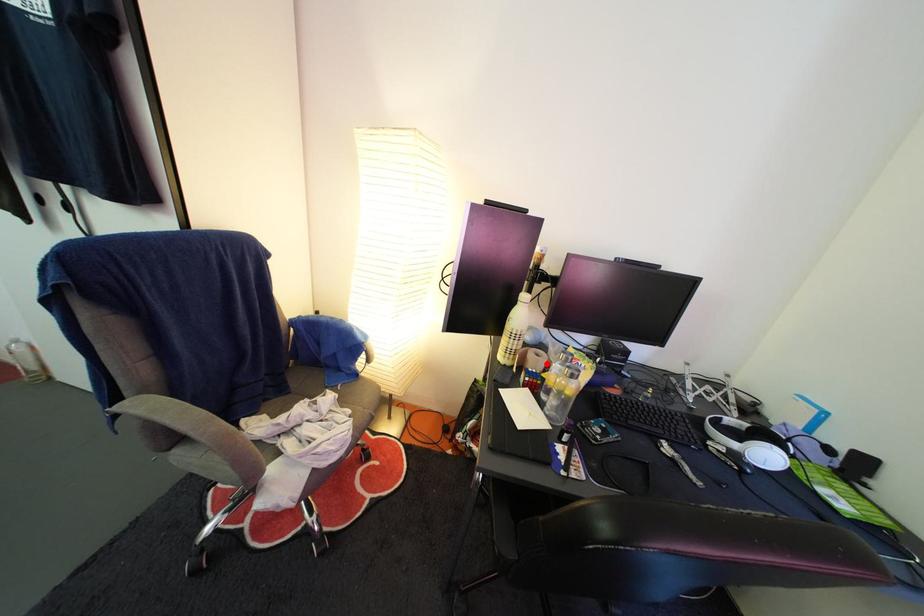
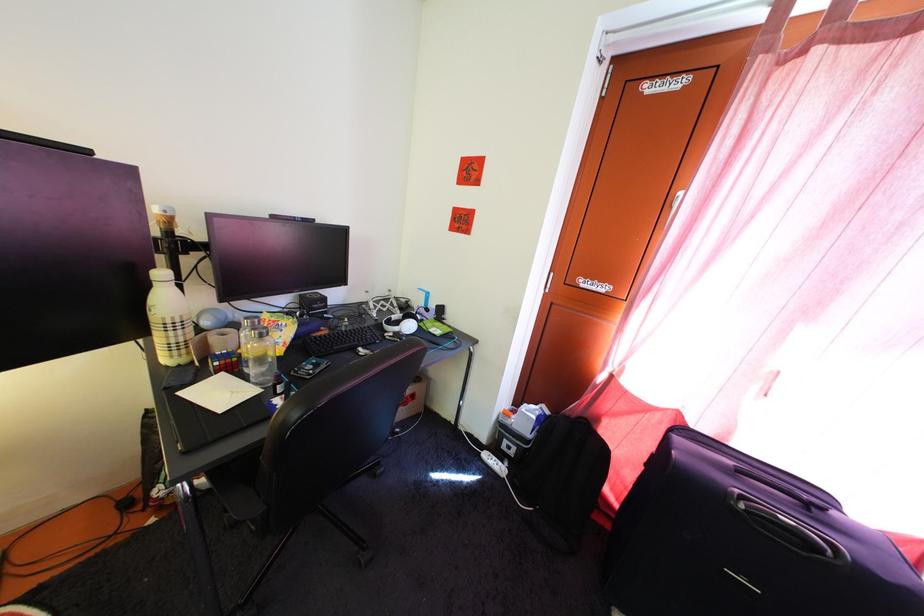
In the second image, find the point that corresponds to the highlighted location in the first image.

(233, 342)